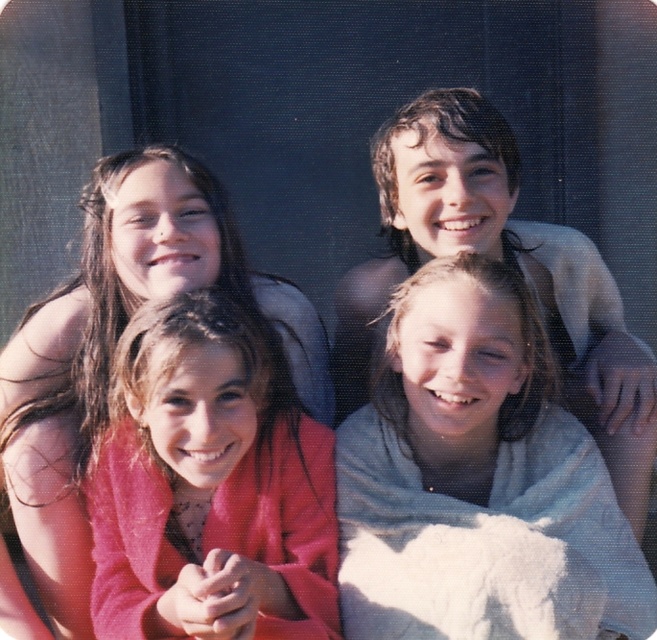
Question: Does matte pink sweater at center have a greater width compared to light gray towel at upper right?

Choices:
 (A) no
 (B) yes

Answer: (A)

Question: Among these points, which one is nearest to the camera?

Choices:
 (A) (424, 113)
 (B) (95, 612)

Answer: (B)

Question: Can you confirm if matte pink sweater at center is bigger than light gray towel at upper right?

Choices:
 (A) yes
 (B) no

Answer: (B)

Question: Which point appears closest to the camera in this image?

Choices:
 (A) (371, 317)
 (B) (271, 401)

Answer: (B)

Question: Which point is closer to the camera taking this photo?

Choices:
 (A) (325, 481)
 (B) (600, 314)

Answer: (A)

Question: Does matte pink sweater at center have a smaller size compared to light gray towel at upper right?

Choices:
 (A) no
 (B) yes

Answer: (B)